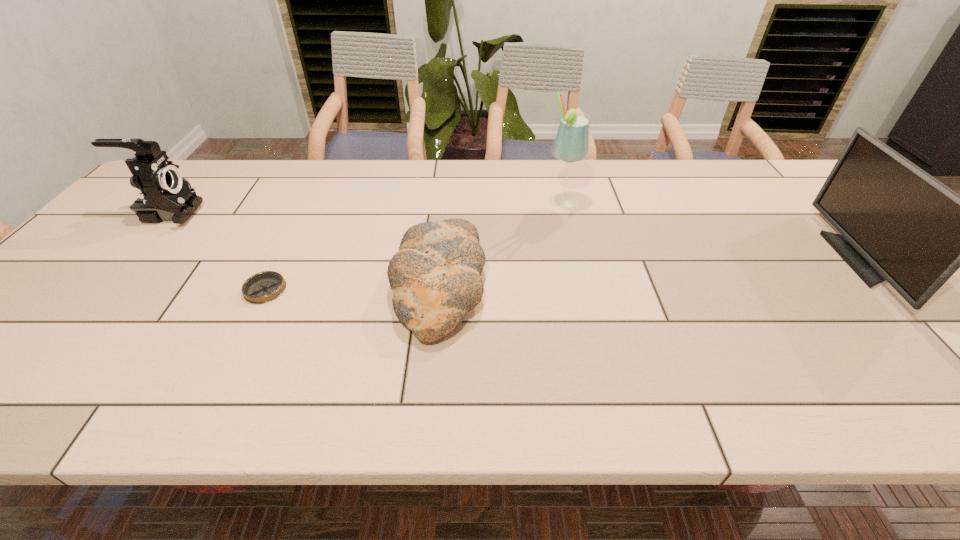
I want to click on object at the far left corner, so click(x=164, y=195).

The image size is (960, 540). I want to click on vacant space at the far edge of the desktop, so click(343, 194).

In the image, there is a desktop. Where is `vacant space at the near edge`? vacant space at the near edge is located at coordinates 512,394.

Locate an element on the screen. Image resolution: width=960 pixels, height=540 pixels. vacant area at the left edge is located at coordinates (36, 344).

Identify the location of free location at the right edge. The image size is (960, 540). (934, 312).

Locate an element on the screen. vacant space at the near right corner is located at coordinates (936, 377).

Where is `empty space that is in between the leftmost object and the shortest object`? Image resolution: width=960 pixels, height=540 pixels. empty space that is in between the leftmost object and the shortest object is located at coordinates (217, 251).

Identify the location of vacant space in between the tallest object and the camcorder. The height and width of the screenshot is (540, 960). click(x=366, y=207).

Where is `empty space that is in between the camcorder and the rightmost object`? empty space that is in between the camcorder and the rightmost object is located at coordinates (514, 236).

The height and width of the screenshot is (540, 960). Identify the location of free point between the second object from right to left and the third tallest object. (366, 207).